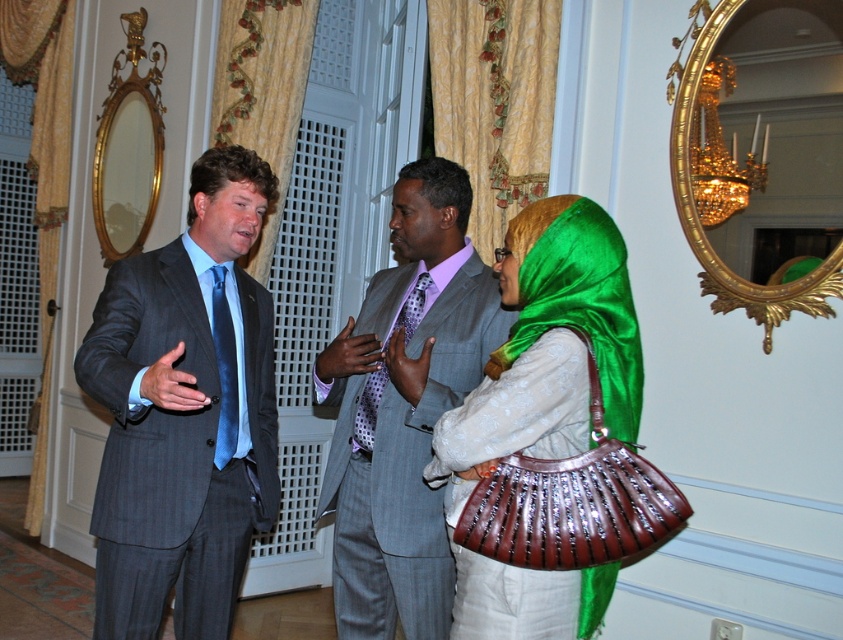
Does shiny green fabric headscarf at center come in front of purple dotted tie at center?

Yes, it is.

Which is in front, point (627, 410) or point (352, 442)?

Positioned in front is point (627, 410).

Identify the location of shiny green fabric headscarf at center. (549, 348).

Does gray pinstripe suit at center lie behind purple dotted tie at center?

No, it is not.

Where is `gray pinstripe suit at center`? The height and width of the screenshot is (640, 843). gray pinstripe suit at center is located at coordinates (403, 408).

Can you confirm if blue silk tie at left is positioned below purple dotted tie at center?

Correct, blue silk tie at left is located below purple dotted tie at center.

Which is in front, point (237, 385) or point (406, 312)?

Positioned in front is point (237, 385).

You are a GUI agent. You are given a task and a screenshot of the screen. Output one action in this format:
    pyautogui.click(x=<x>, y=<y>)
    Task: Click on the blue silk tie at left
    This screenshot has height=640, width=843.
    Given the screenshot: What is the action you would take?
    pyautogui.click(x=224, y=369)